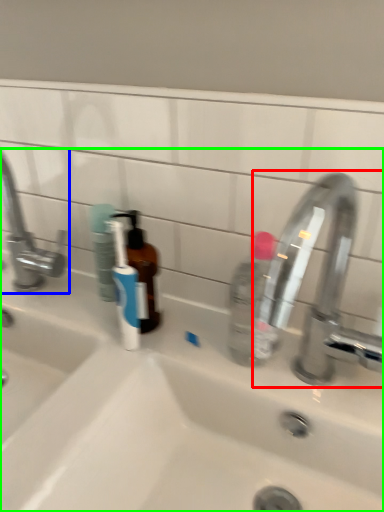
Question: Based on their relative distances, which object is farther from tap (highlighted by a red box)? Choose from tap (highlighted by a blue box) and sink (highlighted by a green box).

Choices:
 (A) tap
 (B) sink

Answer: (A)